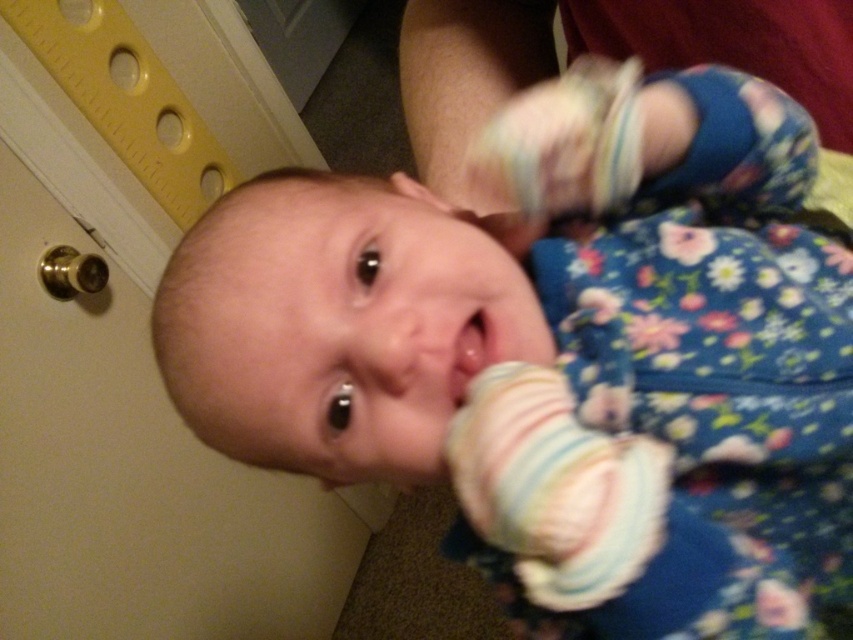
Does floral fabric baby foot at center have a smaller size compared to smooth flesh mouth at center?

No.

Between point (523, 56) and point (456, 392), which one is positioned in front?

Point (456, 392) is in front.

Describe the element at coordinates (463, 76) in the screenshot. I see `floral fabric baby foot at center` at that location.

The image size is (853, 640). Find the location of `floral fabric baby foot at center`. floral fabric baby foot at center is located at coordinates pyautogui.click(x=463, y=76).